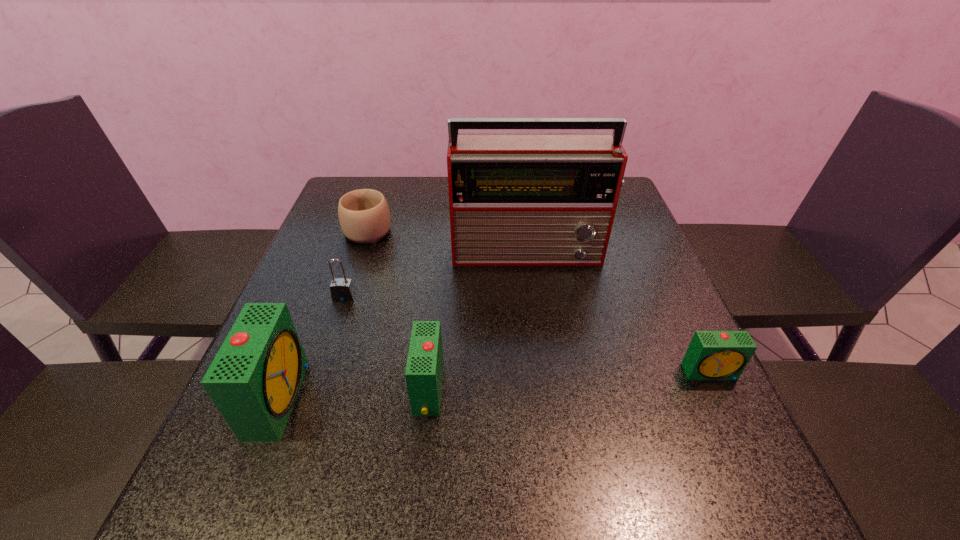
Locate an element on the screen. Image resolution: width=960 pixels, height=540 pixels. the leftmost alarm clock is located at coordinates (254, 379).

The height and width of the screenshot is (540, 960). I want to click on the second tallest object, so click(x=254, y=379).

Locate an element on the screen. the second shortest alarm clock is located at coordinates (424, 369).

Find the location of `the second alarm clock from left to right`. the second alarm clock from left to right is located at coordinates (424, 369).

Locate an element on the screen. the rightmost object is located at coordinates (712, 355).

Where is `the rightmost alarm clock`? The image size is (960, 540). the rightmost alarm clock is located at coordinates (712, 355).

At what (x,y) coordinates should I click in order to perform the action: click on the second object from right to left. Please return your answer as a coordinate pair (x, y). Looking at the image, I should click on (515, 199).

In order to click on radio receiver in this screenshot , I will do [515, 199].

Where is `mug`? Image resolution: width=960 pixels, height=540 pixels. mug is located at coordinates (364, 216).

The height and width of the screenshot is (540, 960). Find the location of `padlock`. padlock is located at coordinates (342, 290).